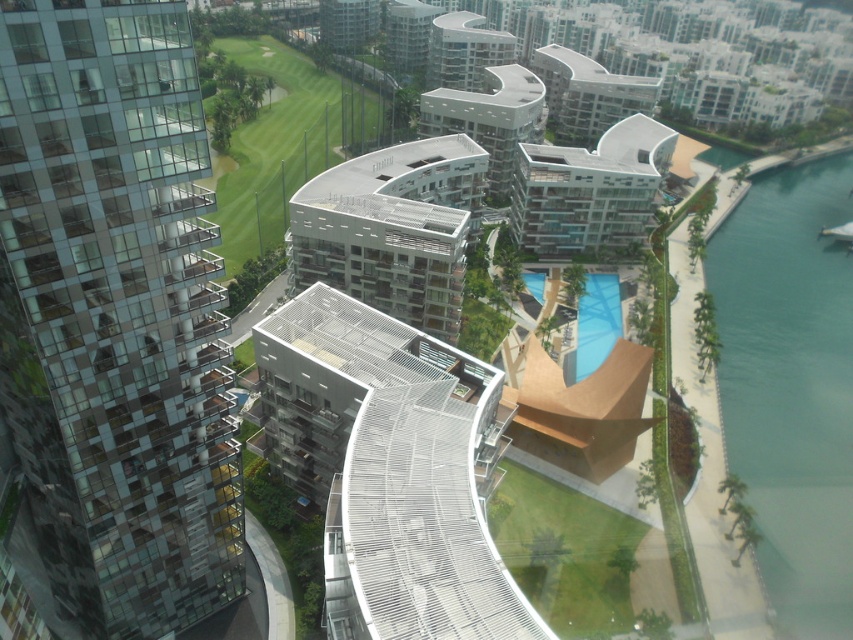
Question: Which object is closer to the camera taking this photo?

Choices:
 (A) green grass at center
 (B) green grass at lower center
 (C) white glass building at center
 (D) glassy reflective building at left

Answer: (D)

Question: Does glassy reflective building at left appear under white glass building at center?

Choices:
 (A) yes
 (B) no

Answer: (A)

Question: Is glassy reflective building at left bigger than white glass building at center?

Choices:
 (A) yes
 (B) no

Answer: (B)

Question: Is glassy reflective building at left below white glass building at center?

Choices:
 (A) no
 (B) yes

Answer: (B)

Question: Which object is positioned closest to the green grass at center?

Choices:
 (A) glassy reflective building at left
 (B) white glass building at center

Answer: (B)

Question: Which point is closer to the camera?

Choices:
 (A) green grass at lower center
 (B) green grass at center
 (C) white glass building at center

Answer: (A)